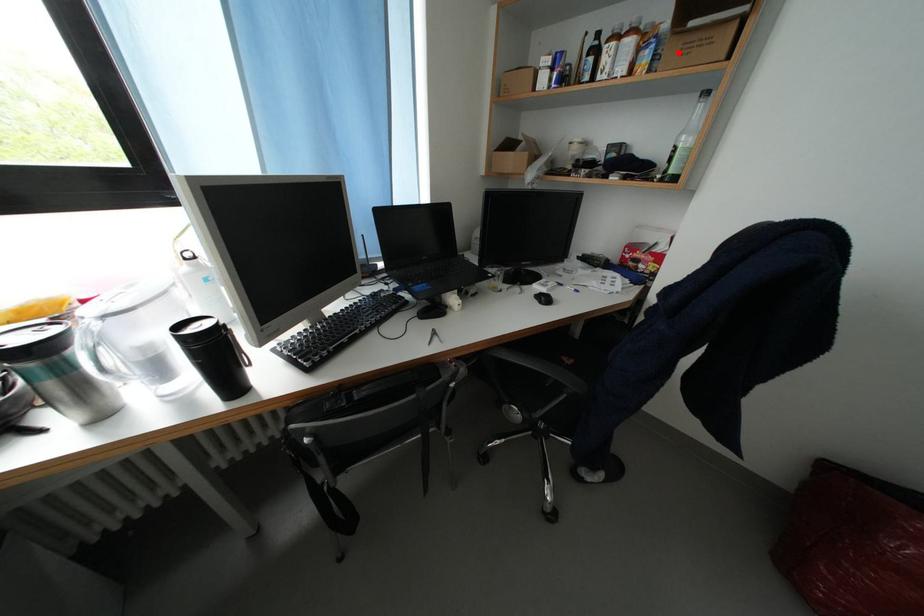
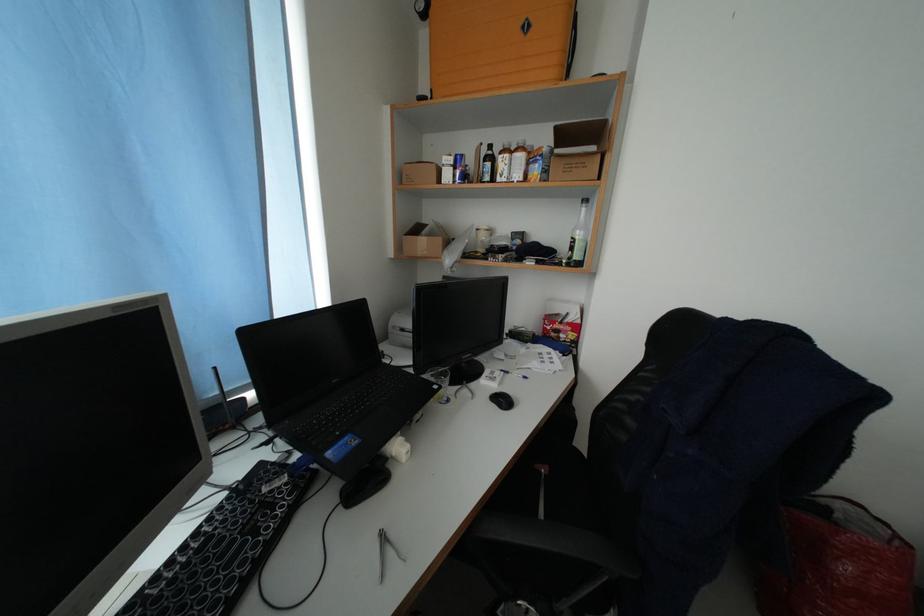
Question: I am providing you with two images of the same scene from different viewpoints. A red point is shown in image1. For the corresponding object point in image2, is it positioned nearer or farther from the camera?

Choices:
 (A) Nearer
 (B) Farther

Answer: (A)